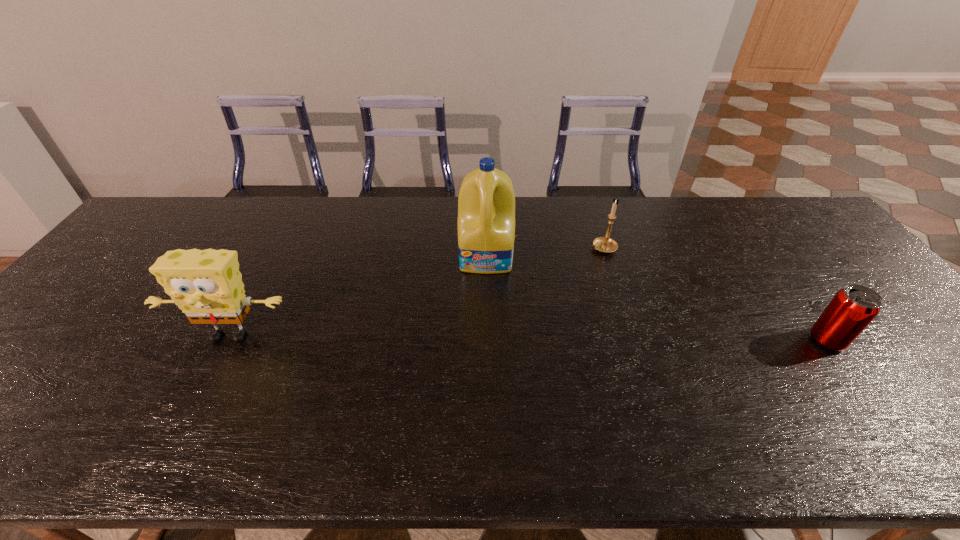
This screenshot has width=960, height=540. I want to click on free space located 0.220m on the label of the tallest object, so click(x=485, y=334).

You are a GUI agent. You are given a task and a screenshot of the screen. Output one action in this format:
    pyautogui.click(x=<x>, y=<y>)
    Task: Click on the vacant space located 0.200m on the handle side of the candle holder
    
    Given the screenshot: What is the action you would take?
    (546, 280)

Identify the location of blank space located on the handle side of the candle holder. The height and width of the screenshot is (540, 960). (506, 304).

The image size is (960, 540). What are the coordinates of `vacant space located on the handle side of the candle holder` in the screenshot? It's located at (575, 264).

In the image, there is a desktop. Where is `free region at the far edge`? This screenshot has width=960, height=540. free region at the far edge is located at coordinates (x=385, y=237).

I want to click on free point at the near edge, so click(x=789, y=399).

In the image, there is a desktop. Where is `vacant space at the left edge`? This screenshot has width=960, height=540. vacant space at the left edge is located at coordinates (5, 373).

This screenshot has width=960, height=540. In the image, there is a desktop. What are the coordinates of `vacant space at the right edge` in the screenshot? It's located at (891, 312).

Find the location of a particular element. The width and height of the screenshot is (960, 540). free space at the far right corner of the desktop is located at coordinates (779, 213).

At what (x,y) coordinates should I click in order to perform the action: click on vacant area that lies between the soda can and the leftmost object. Please return your answer as a coordinate pair (x, y). This screenshot has height=540, width=960. Looking at the image, I should click on [529, 338].